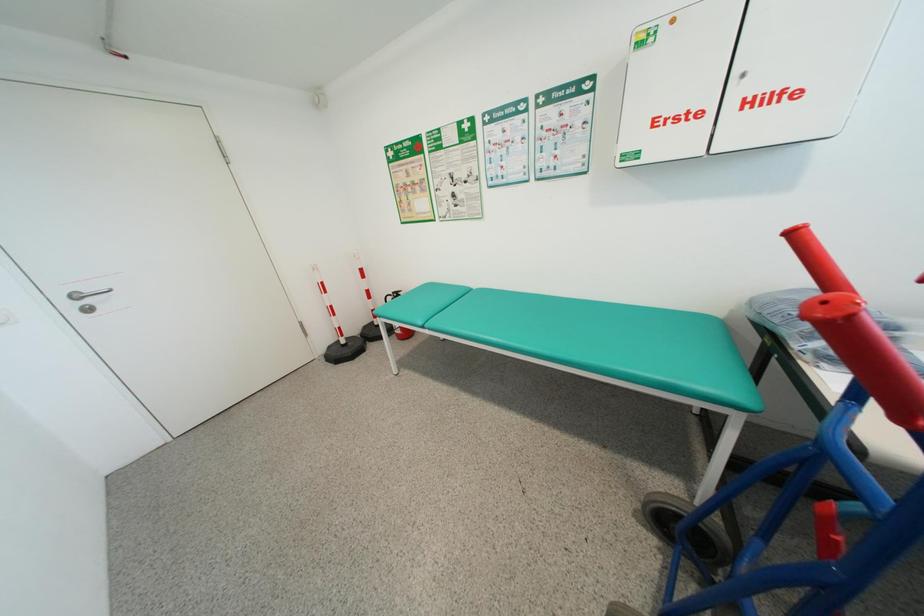
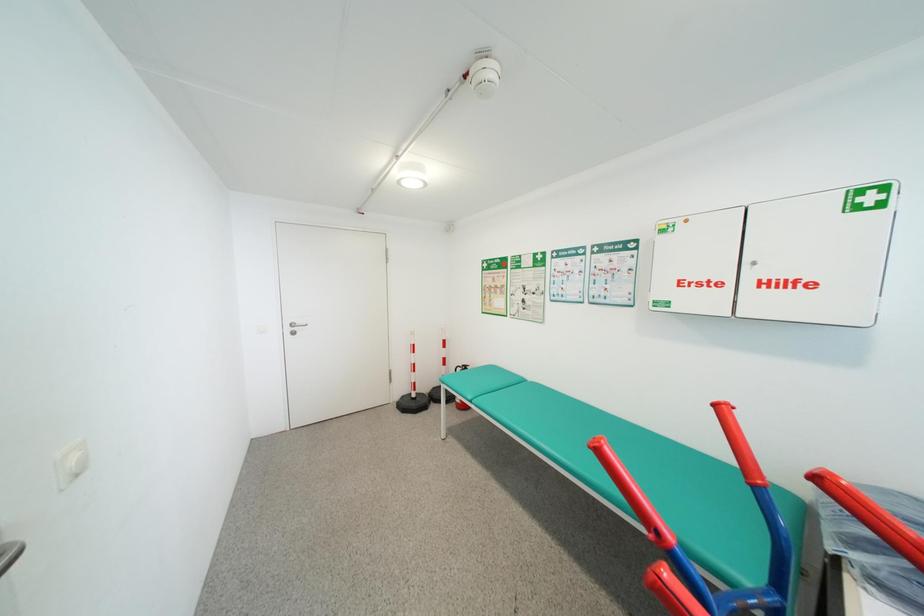
Question: How did the camera likely rotate?

Choices:
 (A) Left
 (B) Right
 (C) Up
 (D) Down

Answer: (A)